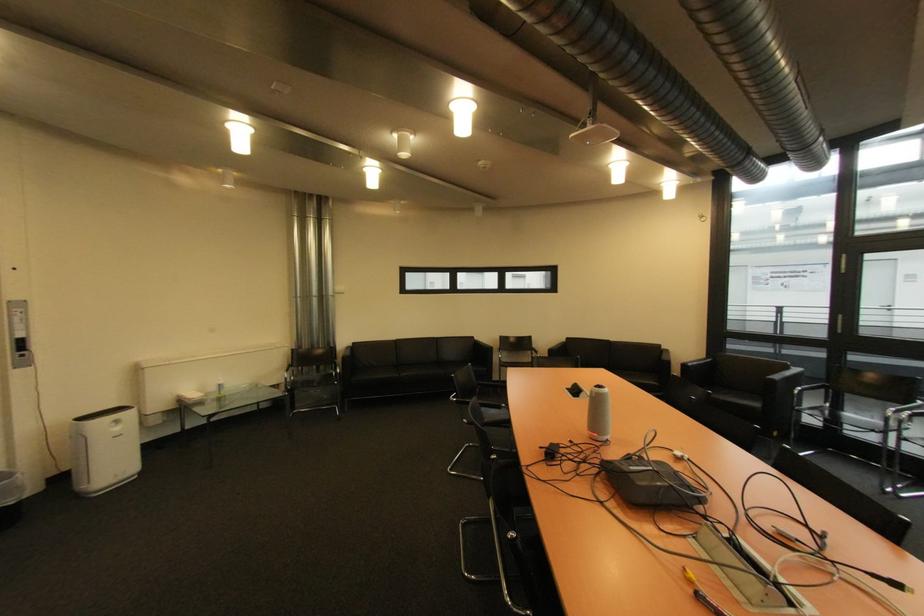
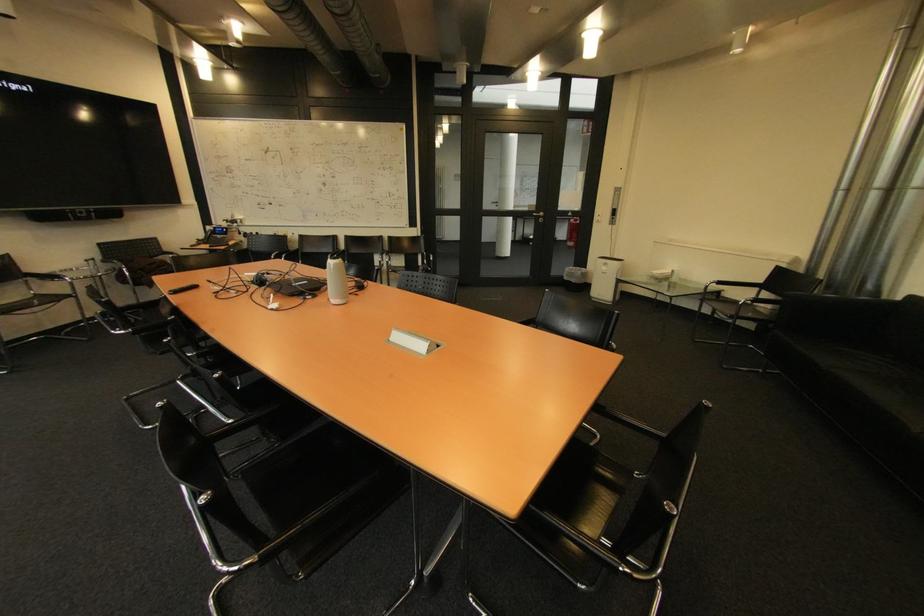
Where in the second image is the point corresponding to [124,430] from the first image?

(613, 270)